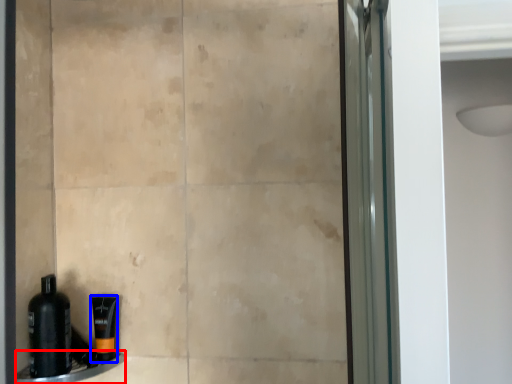
Question: Among these objects, which one is farthest to the camera, ledge (highlighted by a red box) or toiletry (highlighted by a blue box)?

Choices:
 (A) ledge
 (B) toiletry

Answer: (B)